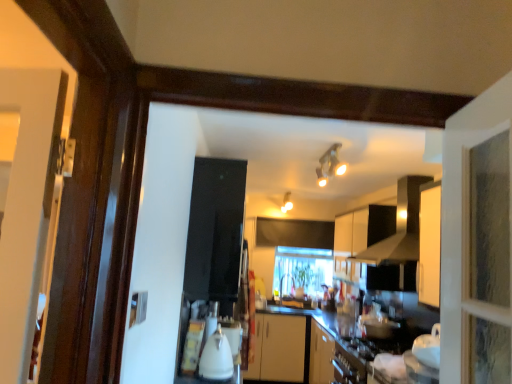
Question: Which direction should I rotate to face matte white light fixture at upper center, acting as the second light fixture starting from the top, — up or down?

Choices:
 (A) down
 (B) up

Answer: (A)

Question: From a real-world perspective, is white glossy kettle at center beneath matte silver light fixture at upper center, the 2th light fixture from the back?

Choices:
 (A) no
 (B) yes

Answer: (B)

Question: Can you confirm if white glossy kettle at center is smaller than matte silver light fixture at upper center, which is the 2th light fixture in bottom-to-top order?

Choices:
 (A) yes
 (B) no

Answer: (A)

Question: Does white glossy kettle at center have a greater width compared to matte silver light fixture at upper center, acting as the first light fixture starting from the right?

Choices:
 (A) no
 (B) yes

Answer: (A)

Question: Is white glossy kettle at center next to matte silver light fixture at upper center, the 2th light fixture from the back?

Choices:
 (A) no
 (B) yes

Answer: (A)

Question: Is white glossy kettle at center closer to camera compared to matte silver light fixture at upper center, which appears as the 2th light fixture when viewed from the left?

Choices:
 (A) yes
 (B) no

Answer: (A)

Question: Is white glossy kettle at center at the right side of matte silver light fixture at upper center, which is the 2th light fixture in bottom-to-top order?

Choices:
 (A) no
 (B) yes

Answer: (A)

Question: Does white matte cabinet at upper center have a larger size compared to white glossy kettle at center?

Choices:
 (A) no
 (B) yes

Answer: (B)

Question: Is white glossy kettle at center located within white matte cabinet at upper center?

Choices:
 (A) no
 (B) yes

Answer: (A)

Question: From the image's perspective, is white matte cabinet at upper center located beneath white glossy kettle at center?

Choices:
 (A) yes
 (B) no

Answer: (B)

Question: Is white matte cabinet at upper center positioned in front of white glossy kettle at center?

Choices:
 (A) no
 (B) yes

Answer: (A)

Question: From a real-world perspective, does white matte cabinet at upper center stand above white glossy kettle at center?

Choices:
 (A) no
 (B) yes

Answer: (B)

Question: From a real-world perspective, is white matte cabinet at upper center below white glossy kettle at center?

Choices:
 (A) yes
 (B) no

Answer: (B)

Question: From a real-world perspective, is matte white light fixture at upper center, arranged as the second light fixture when viewed from the front, physically above black matte exhaust hood at upper center?

Choices:
 (A) yes
 (B) no

Answer: (A)